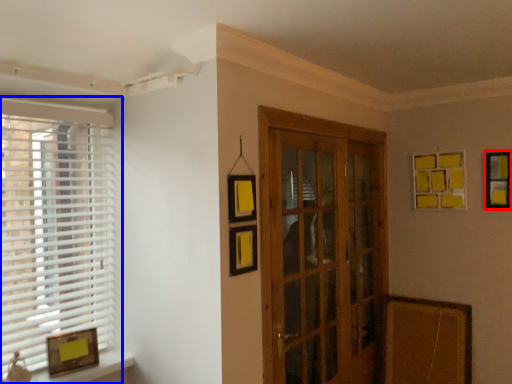
Question: Which of the following is the farthest to the observer, picture frame (highlighted by a red box) or window (highlighted by a blue box)?

Choices:
 (A) picture frame
 (B) window

Answer: (A)